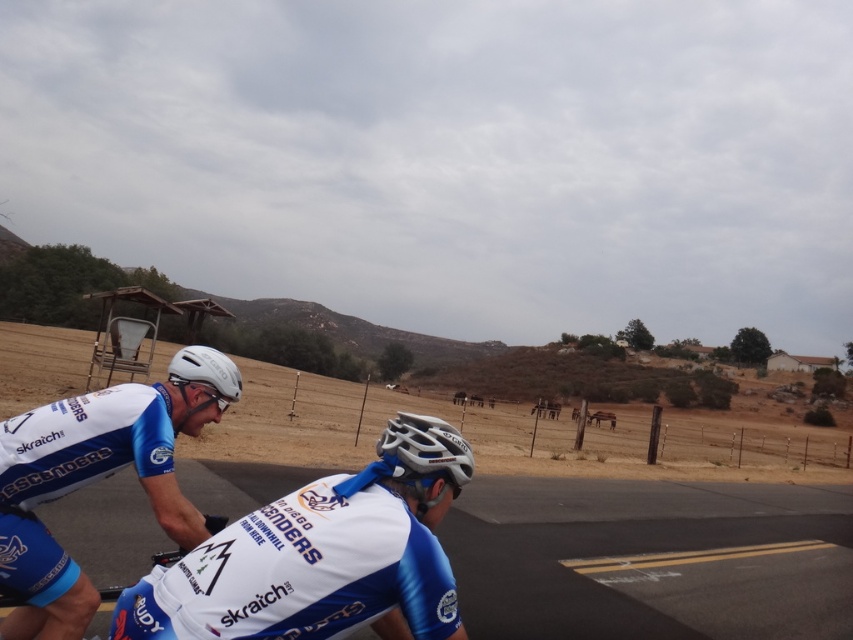
Question: Which point is farther to the camera?

Choices:
 (A) white matte helmet at upper center
 (B) white glossy helmet at upper left
 (C) blue matte bicycle at lower left
 (D) white matte helmet at upper left

Answer: (D)

Question: Which point is closer to the camera?

Choices:
 (A) click(21, 598)
 (B) click(318, 609)
 (C) click(387, 442)
 (D) click(218, 515)

Answer: (B)

Question: Is white matte bicycle helmet at center closer to camera compared to blue matte bicycle at lower left?

Choices:
 (A) yes
 (B) no

Answer: (A)

Question: Considering the real-world distances, which object is closest to the blue matte bicycle at lower left?

Choices:
 (A) white matte bicycle helmet at center
 (B) white matte helmet at upper left
 (C) white glossy helmet at upper left

Answer: (C)

Question: In this image, where is white matte helmet at upper center located relative to white glossy helmet at upper left?

Choices:
 (A) below
 (B) above

Answer: (A)

Question: Does white matte helmet at upper left appear over blue matte bicycle at lower left?

Choices:
 (A) no
 (B) yes

Answer: (B)